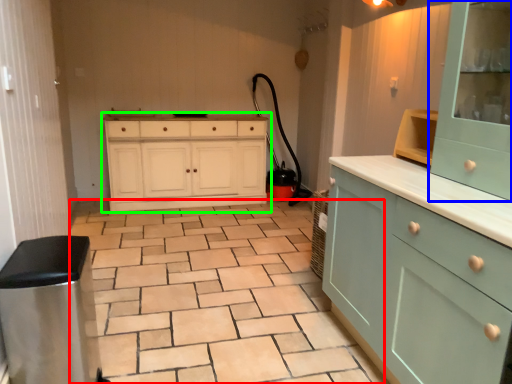
Question: Which is nearer to the ceramic tile (highlighted by a red box)? cabinetry (highlighted by a blue box) or chest of drawers (highlighted by a green box).

Choices:
 (A) cabinetry
 (B) chest of drawers

Answer: (B)